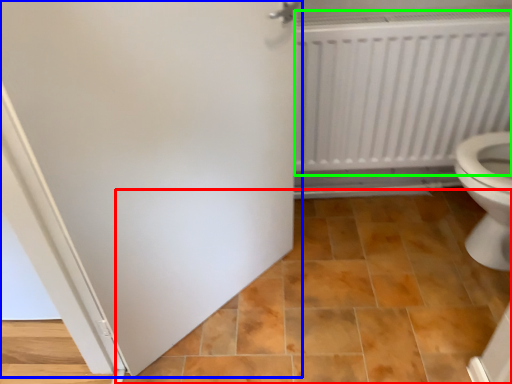
Question: Which object is the farthest from ceramic tile (highlighted by a red box)? Choose among these: door (highlighted by a blue box) or radiator (highlighted by a green box).

Choices:
 (A) door
 (B) radiator

Answer: (B)